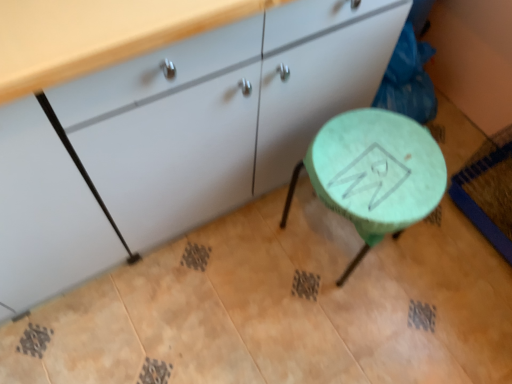
What are the coordinates of `vacant space underneath green matte stool at center (from a real-world perspective)` in the screenshot? It's located at (334, 241).